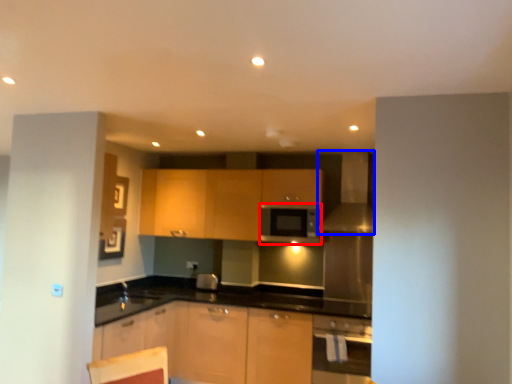
Question: Which object is closer to the camera taking this photo, appliance (highlighted by a red box) or exhaust hood (highlighted by a blue box)?

Choices:
 (A) appliance
 (B) exhaust hood

Answer: (B)